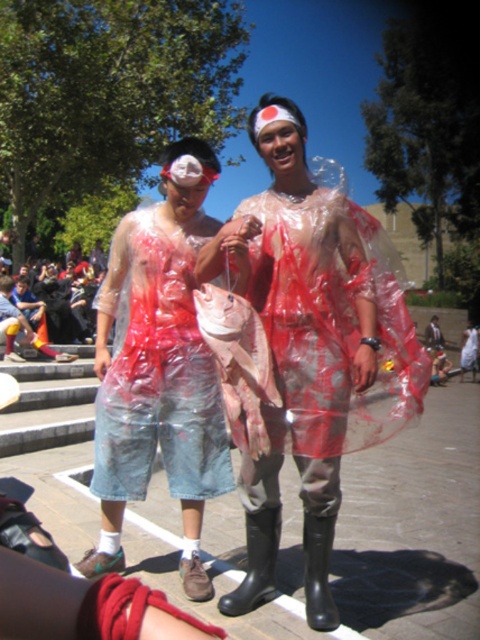
From the picture: Who is higher up, transparent plastic fish at center or transparent plastic bag at center?

transparent plastic fish at center

Can you confirm if transparent plastic fish at center is positioned to the left of transparent plastic bag at center?

Incorrect, transparent plastic fish at center is not on the left side of transparent plastic bag at center.

Find the location of a particular element. transparent plastic fish at center is located at coordinates (312, 348).

At what (x,y) coordinates should I click in order to perform the action: click on transparent plastic fish at center. Please return your answer as a coordinate pair (x, y). The image size is (480, 640). Looking at the image, I should click on (312, 348).

Is transparent plastic bag at center shorter than matte plastic bag at center?

In fact, transparent plastic bag at center may be taller than matte plastic bag at center.

Identify the location of transparent plastic bag at center. This screenshot has height=640, width=480. (157, 369).

The height and width of the screenshot is (640, 480). What are the coordinates of `transparent plastic bag at center` in the screenshot? It's located at (157, 369).

Does transparent plastic fish at center come behind matte plastic bag at center?

No, it is not.

Between transparent plastic fish at center and matte plastic bag at center, which one is positioned lower?

transparent plastic fish at center is below.

Does point (377, 276) lie behind point (8, 301)?

No, it is in front of (8, 301).

Identify the location of transparent plastic fish at center. (312, 348).